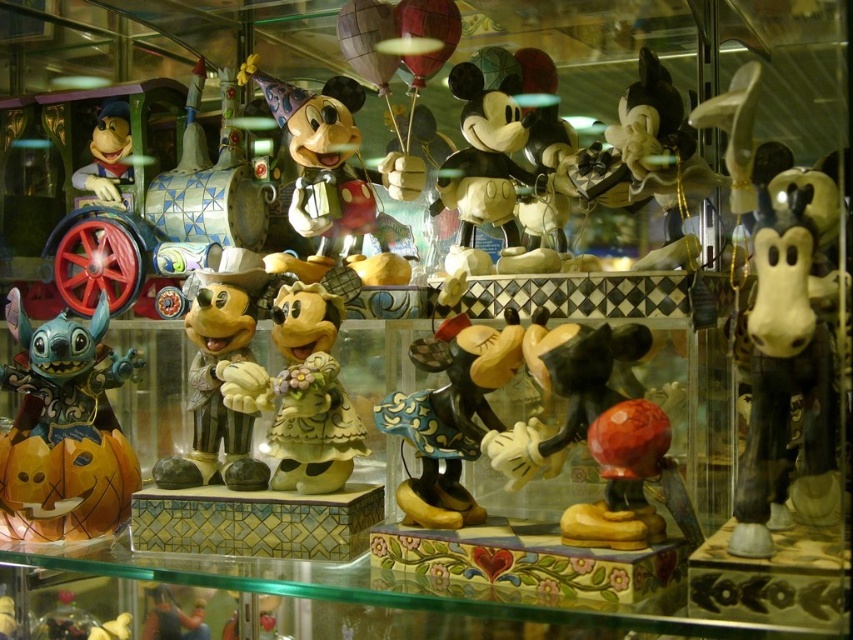
You are a collector who wants to place a new small statue on the shelf next to the matte orange pumpkin at left and the porcelain minnie mouse at center. Which of the two existing items should the new statue be placed next to if it needs to be shorter than both?

The new statue should be placed next to the porcelain minnie mouse at center because it is shorter than the matte orange pumpkin at left.

You are organizing a Halloween display and need to place the matte orange pumpkin at left and the matte yellow figure at left in a specific order. According to the scene, which object is positioned to the right of the other?

The matte orange pumpkin at left is to the right of the matte yellow figure at left.

You are a visitor at a Disney exhibit and want to take a photo of both the white glossy statue at right and the matte ceramic mickey mouse at center. Since you can only focus on one object at a time, which one should you position closer to the camera to ensure it is in focus while the other remains slightly blurred?

To ensure the matte ceramic mickey mouse at center is in focus while the white glossy statue at right is blurred, position the matte ceramic mickey mouse at center closer to the camera. Since the white glossy statue at right is to the right of matte ceramic mickey mouse at center, adjusting focus on the closer object will naturally blur the one further away.